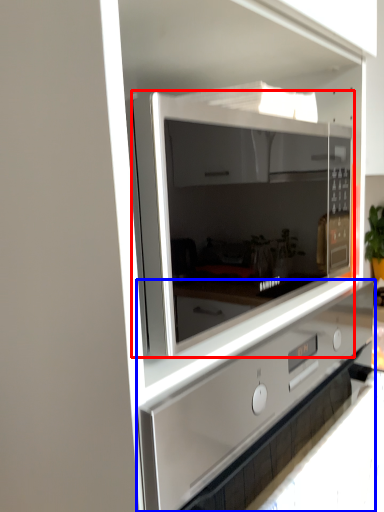
Question: Which object is closer to the camera taking this photo, microwave oven (highlighted by a red box) or home appliance (highlighted by a blue box)?

Choices:
 (A) microwave oven
 (B) home appliance

Answer: (B)